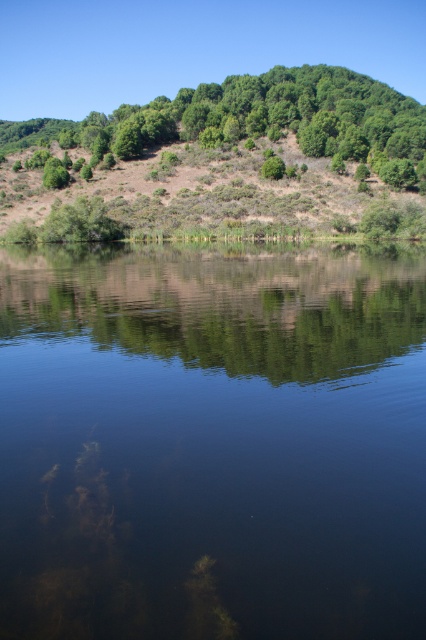
Is the position of transparent water at center more distant than that of green leafy hillside at upper center?

No, it is not.

Is transparent water at center closer to camera compared to green leafy hillside at upper center?

Yes, transparent water at center is closer to the viewer.

Does point (25, 532) come behind point (52, 154)?

No, (25, 532) is in front of (52, 154).

The width and height of the screenshot is (426, 640). I want to click on transparent water at center, so click(212, 442).